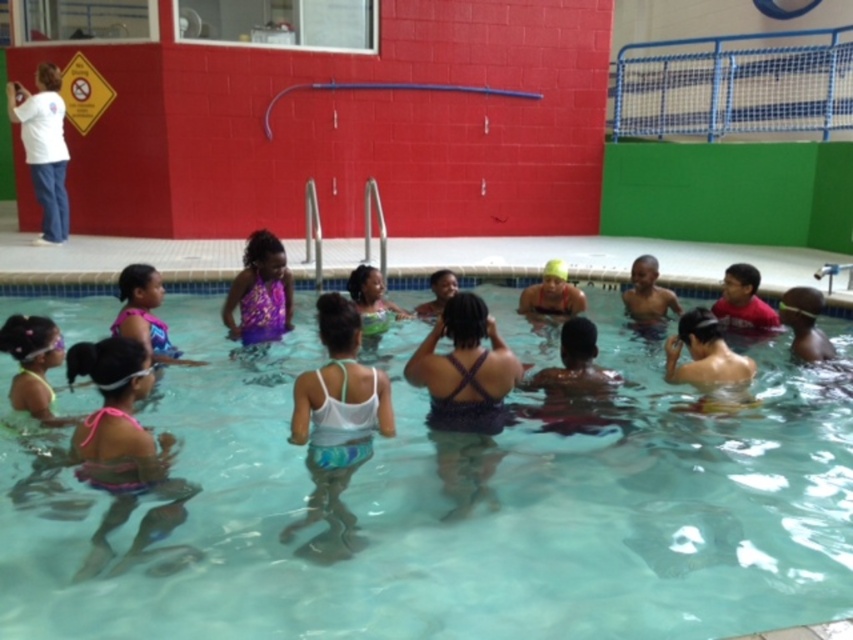
You are a lifeguard on duty at the pool. You notice a potential hazard at point (454, 506). What is located at that point?

At point (454, 506) lies clear plastic water at center.

You are a photographer taking pictures from the side of the pool. You notice the pink fabric swimsuit at lower left and the white smooth shirt at upper left. Which one is positioned lower in the image?

The pink fabric swimsuit at lower left is positioned lower than the white smooth shirt at upper left.